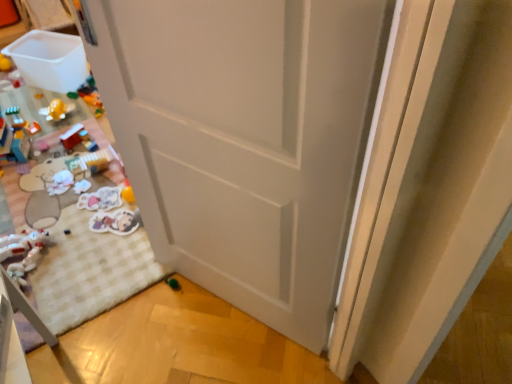
Question: Considering the relative sizes of translucent plastic toy at left, which is the 8th toy from right to left, and white plush toy at lower left, marked as the 7th toy in a right-to-left arrangement, in the image provided, is translucent plastic toy at left, which is the 8th toy from right to left, thinner than white plush toy at lower left, marked as the 7th toy in a right-to-left arrangement,?

Choices:
 (A) yes
 (B) no

Answer: (A)

Question: Does translucent plastic toy at left, which is the 1th toy in left-to-right order, have a lesser height compared to white plush toy at lower left, which is counted as the 2th toy, starting from the left?

Choices:
 (A) yes
 (B) no

Answer: (B)

Question: Would you say translucent plastic toy at left, which is the 8th toy from right to left, is a long distance from white plush toy at lower left, which is counted as the 2th toy, starting from the left?

Choices:
 (A) no
 (B) yes

Answer: (A)

Question: Does translucent plastic toy at left, which is the 1th toy in left-to-right order, have a greater width compared to white plush toy at lower left, which is counted as the 2th toy, starting from the left?

Choices:
 (A) yes
 (B) no

Answer: (B)

Question: Is the depth of translucent plastic toy at left, which is the 8th toy from right to left, less than that of white plush toy at lower left, which is counted as the 2th toy, starting from the left?

Choices:
 (A) yes
 (B) no

Answer: (B)

Question: From a real-world perspective, is matte black toy at lower left, the 5th toy in the left-to-right sequence, above or below matte plastic stickers at lower left, marked as the third toy in a right-to-left arrangement?

Choices:
 (A) below
 (B) above

Answer: (B)

Question: Is matte black toy at lower left, the 4th toy from the right, inside the boundaries of matte plastic stickers at lower left, which ranks as the sixth toy in left-to-right order, or outside?

Choices:
 (A) outside
 (B) inside

Answer: (A)

Question: Is matte black toy at lower left, the 4th toy from the right, in front of or behind matte plastic stickers at lower left, which ranks as the sixth toy in left-to-right order, in the image?

Choices:
 (A) behind
 (B) front

Answer: (B)

Question: Considering the relative positions of matte black toy at lower left, the 5th toy in the left-to-right sequence, and matte plastic stickers at lower left, which ranks as the sixth toy in left-to-right order, in the image provided, is matte black toy at lower left, the 5th toy in the left-to-right sequence, to the left or to the right of matte plastic stickers at lower left, which ranks as the sixth toy in left-to-right order,?

Choices:
 (A) left
 (B) right

Answer: (A)

Question: Is white plush toy at lower left, positioned as the 4th toy in left-to-right order, wider or thinner than matte plastic toy at lower left, positioned as the 3th toy in left-to-right order?

Choices:
 (A) wide
 (B) thin

Answer: (A)

Question: Is white plush toy at lower left, which ranks as the fifth toy in right-to-left order, in front of or behind matte plastic toy at lower left, positioned as the 3th toy in left-to-right order, in the image?

Choices:
 (A) behind
 (B) front

Answer: (B)

Question: In the image, is white plush toy at lower left, which ranks as the fifth toy in right-to-left order, on the left side or the right side of matte plastic toy at lower left, positioned as the 3th toy in left-to-right order?

Choices:
 (A) left
 (B) right

Answer: (B)

Question: From the image's perspective, is white plush toy at lower left, which ranks as the fifth toy in right-to-left order, above or below matte plastic toy at lower left, the 6th toy when ordered from right to left?

Choices:
 (A) below
 (B) above

Answer: (A)

Question: From a real-world perspective, is matte plastic stickers at lower left, marked as the third toy in a right-to-left arrangement, above or below white plush toy at lower left, marked as the 7th toy in a right-to-left arrangement?

Choices:
 (A) below
 (B) above

Answer: (A)

Question: Is matte plastic stickers at lower left, which ranks as the sixth toy in left-to-right order, taller or shorter than white plush toy at lower left, which is counted as the 2th toy, starting from the left?

Choices:
 (A) short
 (B) tall

Answer: (A)